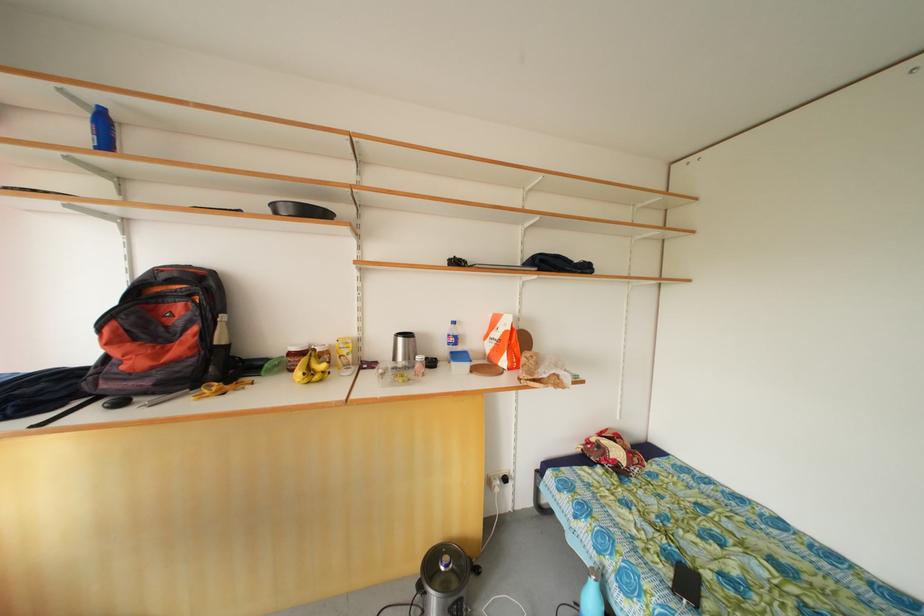
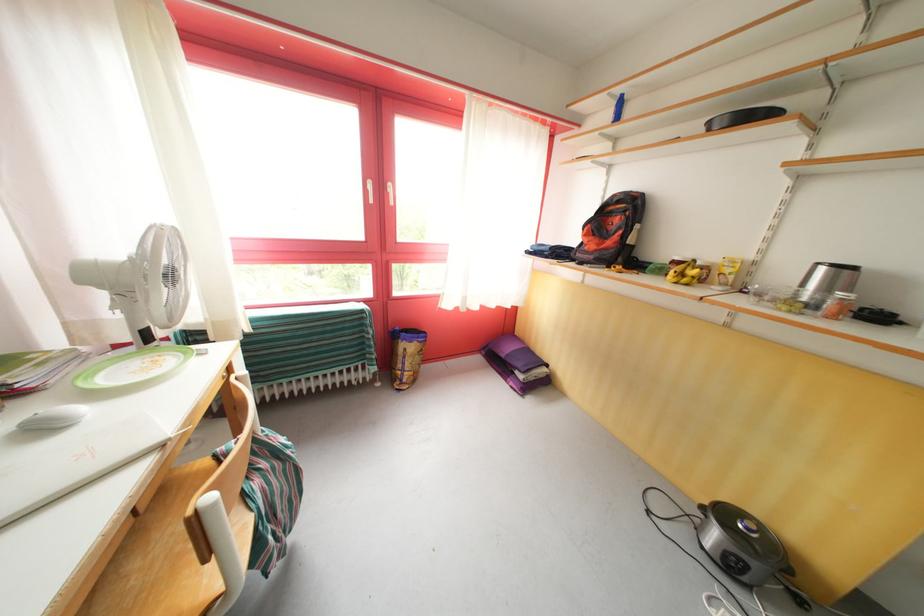
The first image is from the beginning of the video and the second image is from the end. How did the camera likely rotate when shooting the video?

The rotation direction of the camera is left-down.